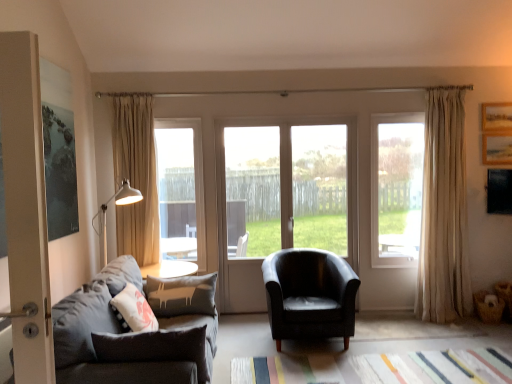
Question: Is clear glass window at center, the 3th window from the left, to the left or to the right of black leather armchair at center in the image?

Choices:
 (A) left
 (B) right

Answer: (B)

Question: Considering the positions of point (373, 120) and point (314, 294), is point (373, 120) closer or farther from the camera than point (314, 294)?

Choices:
 (A) farther
 (B) closer

Answer: (A)

Question: Estimate the real-world distances between objects in this image. Which object is closer to the black leather armchair at center?

Choices:
 (A) dark gray fabric couch at left
 (B) clear glass door at center, positioned as the first window in left-to-right order
 (C) beige fabric curtain at right, acting as the second curtain starting from the left
 (D) clear glass window at center, the 3th window from the left
 (E) wooden picture frame at upper right

Answer: (A)

Question: Based on their relative distances, which object is nearer to the clear glass door at center, positioned as the first window in left-to-right order?

Choices:
 (A) transparent glass door at center, which ranks as the second window in right-to-left order
 (B) black leather armchair at center
 (C) beige fabric curtain at right, acting as the second curtain starting from the left
 (D) dark gray fabric couch at left
 (E) clear glass window at center, which is the 1th window from right to left

Answer: (A)